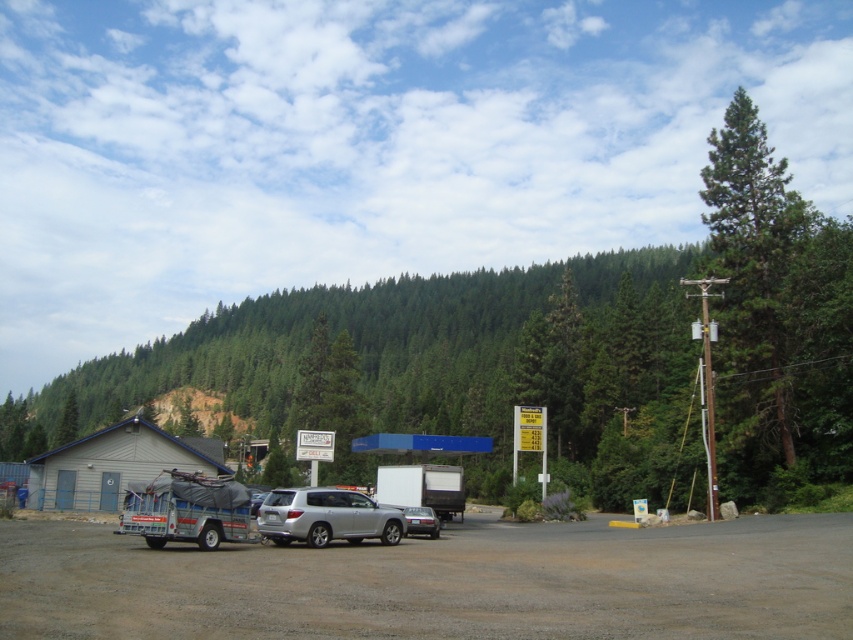
Is green matte tree at right taller than silver metallic sedan at center?

Correct, green matte tree at right is much taller as silver metallic sedan at center.

Can you confirm if green matte tree at right is positioned below silver metallic sedan at center?

No.

Identify the location of green matte tree at right. (752, 288).

Is point (270, 525) positioned before point (439, 474)?

Yes, it is in front of point (439, 474).

Based on the photo, does silver metallic suv at center appear on the right side of white matte truck at center?

Incorrect, silver metallic suv at center is not on the right side of white matte truck at center.

Is point (393, 536) farther from viewer compared to point (396, 470)?

No, it is in front of (396, 470).

Locate an element on the screen. Image resolution: width=853 pixels, height=640 pixels. silver metallic suv at center is located at coordinates (326, 516).

Does dark gray asphalt parking lot at center have a greater height compared to silver metallic suv at center?

Yes, dark gray asphalt parking lot at center is taller than silver metallic suv at center.

Who is shorter, dark gray asphalt parking lot at center or silver metallic suv at center?

silver metallic suv at center is shorter.

Where is `dark gray asphalt parking lot at center`? The image size is (853, 640). dark gray asphalt parking lot at center is located at coordinates (439, 582).